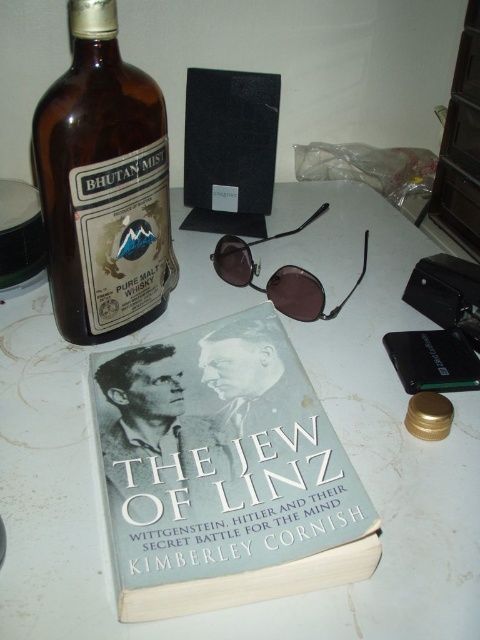
You are a photographer taking a closeup shot of the hardcover book at center and the metallic brown sunglasses at center on a table. To ensure both items are in focus, which one should you adjust the camera focus to prioritize first?

The hardcover book at center is closer to the viewer than the metallic brown sunglasses at center, so you should prioritize focusing on the hardcover book at center first to ensure both are in focus.

You are organizing items on a table and need to place the brown glass bottle at upper left and the metallic brown sunglasses at center. According to the spatial arrangement shown in the image, which item is closer to you?

The brown glass bottle at upper left is closer to you because it is in front of the metallic brown sunglasses at center.

You are organizing items on a table and need to place a new object between the hardcover book at center and the brown glass bottle at upper left. Based on their current positions, where should you position the new object to ensure it is between them?

The hardcover book at center is in front of the brown glass bottle at upper left, so to place a new object between them, position it in the space between the hardcover book at center and the brown glass bottle at upper left, ensuring it is closer to the book than the bottle since the book is in front.